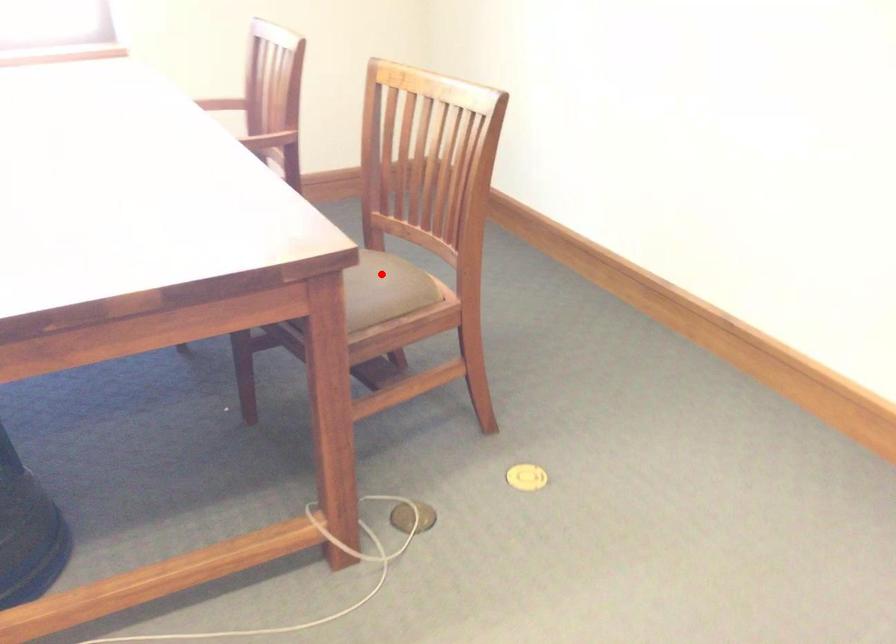
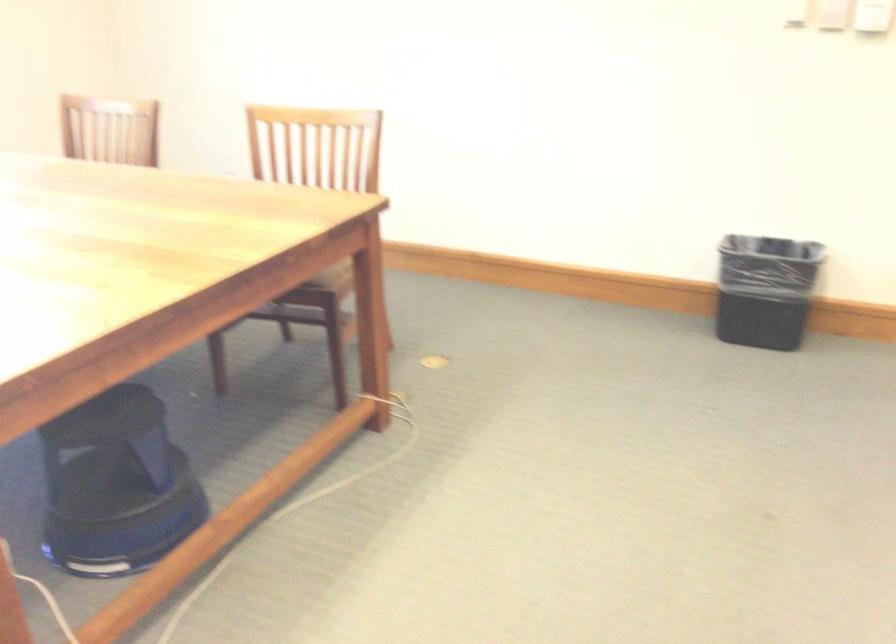
Question: I am providing you with two images of the same scene from different viewpoints. A red point is marked on the first image. Can you still see the location of the red point in image 2?

Choices:
 (A) Yes
 (B) No

Answer: (B)